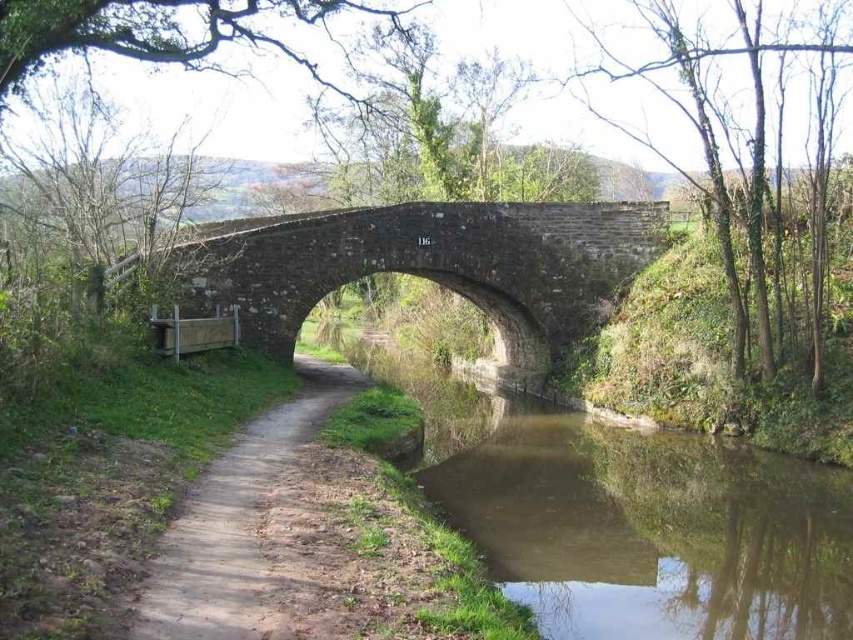
Is brown stone bridge at center behind dirt path at center?

Yes, it is behind dirt path at center.

The height and width of the screenshot is (640, 853). I want to click on brown stone bridge at center, so click(x=426, y=266).

Is brown smooth water at lower center further to camera compared to brown stone bridge at center?

No.

Is brown smooth water at lower center wider than brown stone bridge at center?

In fact, brown smooth water at lower center might be narrower than brown stone bridge at center.

Who is more forward, (537, 588) or (289, 332)?

Point (537, 588) is in front.

The height and width of the screenshot is (640, 853). In order to click on brown smooth water at lower center in this screenshot , I will do `click(625, 515)`.

Does point (463, 529) lie in front of point (190, 560)?

That is False.

Measure the distance between brown smooth water at lower center and camera.

21.80 meters

Is point (715, 451) positioned behind point (294, 557)?

Yes, point (715, 451) is behind point (294, 557).

Where is `brown smooth water at lower center`? brown smooth water at lower center is located at coordinates (625, 515).